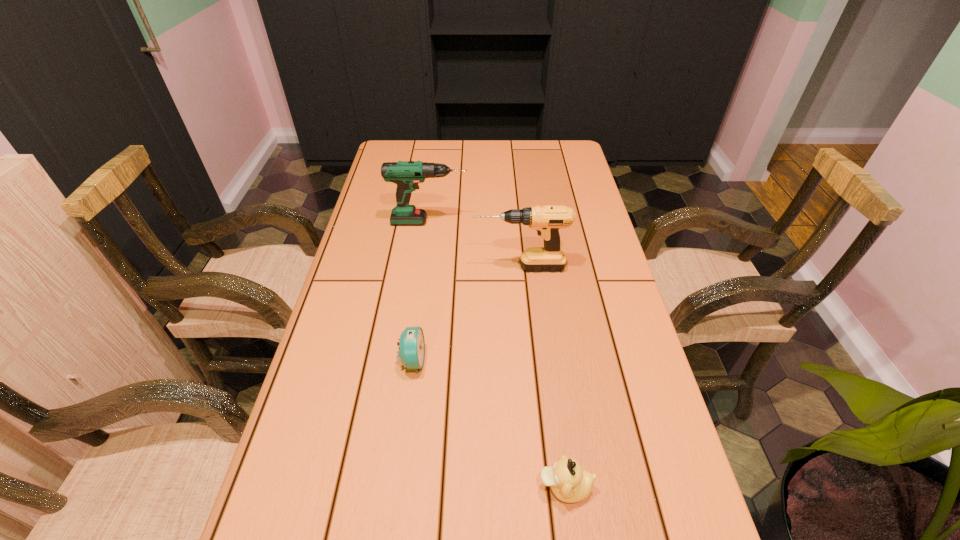
The width and height of the screenshot is (960, 540). I want to click on the left drill, so click(406, 174).

At what (x,y) coordinates should I click in order to perform the action: click on the farther drill. Please return your answer as a coordinate pair (x, y). The width and height of the screenshot is (960, 540). Looking at the image, I should click on (406, 174).

The height and width of the screenshot is (540, 960). I want to click on the right drill, so click(x=547, y=220).

Identify the location of the second farthest object. (547, 220).

Locate an element on the screen. the third farthest object is located at coordinates (411, 351).

Find the location of a particular element. The height and width of the screenshot is (540, 960). the nearest object is located at coordinates point(570,483).

This screenshot has height=540, width=960. In order to click on free space located 0.050m on the handle side of the farthest object in this screenshot , I will do `click(484, 222)`.

I want to click on free region located at the tip of the right drill, so click(x=392, y=267).

The image size is (960, 540). Identify the location of free region located 0.100m at the tip of the right drill. (438, 267).

Image resolution: width=960 pixels, height=540 pixels. Identify the location of free location located 0.310m at the tip of the right drill. (363, 267).